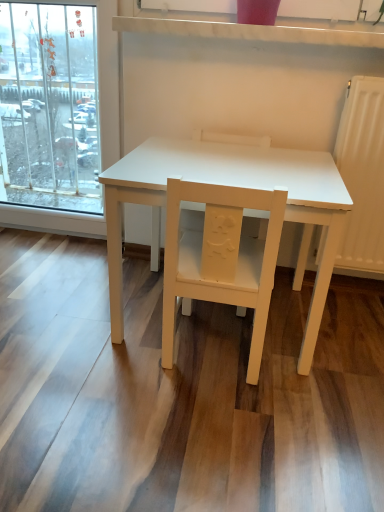
What do you see at coordinates (230, 138) in the screenshot? This screenshot has width=384, height=512. I see `white matte chair at center, the 1th chair viewed from the back` at bounding box center [230, 138].

Identify the location of white matte chair at center, the 1th chair viewed from the back. This screenshot has width=384, height=512. (230, 138).

Describe the element at coordinates (221, 258) in the screenshot. The image size is (384, 512). I see `matte yellow chair at center, arranged as the second chair when viewed from the back` at that location.

At what (x,y) coordinates should I click in order to perform the action: click on white matte table at center. Please return your answer as a coordinate pair (x, y). The width and height of the screenshot is (384, 512). Looking at the image, I should click on (232, 185).

From the image's perspective, is white matte table at center under matte yellow chair at center, arranged as the second chair when viewed from the back?

Incorrect, from the image's perspective, white matte table at center is higher than matte yellow chair at center, arranged as the second chair when viewed from the back.

Is point (336, 220) positioned after point (208, 259)?

No, it is not.

Where is `table above the matte yellow chair at center, the 1th chair positioned from the front (from the image's perspective)`? The width and height of the screenshot is (384, 512). table above the matte yellow chair at center, the 1th chair positioned from the front (from the image's perspective) is located at coordinates (232, 185).

Considering the sizes of objects white matte table at center and matte yellow chair at center, the 1th chair positioned from the front, in the image provided, who is thinner, white matte table at center or matte yellow chair at center, the 1th chair positioned from the front,?

matte yellow chair at center, the 1th chair positioned from the front, is thinner.

Which is behind, point (293, 170) or point (196, 131)?

Positioned behind is point (196, 131).

Who is taller, white matte table at center or white matte chair at center, which appears as the 2th chair when viewed from the front?

Standing taller between the two is white matte chair at center, which appears as the 2th chair when viewed from the front.

Is white matte chair at center, the 1th chair viewed from the back, a part of white matte table at center?

Yes, white matte chair at center, the 1th chair viewed from the back, is surrounded by white matte table at center.

Does point (254, 248) lie behind point (317, 166)?

Yes, it is.

Is matte yellow chair at center, arranged as the second chair when viewed from the back, at the right side of white matte table at center?

In fact, matte yellow chair at center, arranged as the second chair when viewed from the back, is to the left of white matte table at center.

Is white matte table at center at the back of matte yellow chair at center, the 1th chair positioned from the front?

That's right, matte yellow chair at center, the 1th chair positioned from the front, is facing away from white matte table at center.

Can you see matte yellow chair at center, the 1th chair positioned from the front, touching white matte chair at center, which appears as the 2th chair when viewed from the front?

No, matte yellow chair at center, the 1th chair positioned from the front, is not with white matte chair at center, which appears as the 2th chair when viewed from the front.

Based on the photo, is white matte chair at center, the 1th chair viewed from the back, located within matte yellow chair at center, arranged as the second chair when viewed from the back?

Actually, white matte chair at center, the 1th chair viewed from the back, is outside matte yellow chair at center, arranged as the second chair when viewed from the back.

Which is behind, matte yellow chair at center, arranged as the second chair when viewed from the back, or white matte chair at center, the 1th chair viewed from the back?

white matte chair at center, the 1th chair viewed from the back, is more distant.

Is matte yellow chair at center, arranged as the second chair when viewed from the back, bigger than white matte chair at center, the 1th chair viewed from the back?

Incorrect, matte yellow chair at center, arranged as the second chair when viewed from the back, is not larger than white matte chair at center, the 1th chair viewed from the back.

Based on the photo, does white matte chair at center, the 1th chair viewed from the back, have a lesser width compared to white matte table at center?

Correct, the width of white matte chair at center, the 1th chair viewed from the back, is less than that of white matte table at center.

From a real-world perspective, is white matte chair at center, the 1th chair viewed from the back, below white matte table at center?

No, from a real-world perspective, white matte chair at center, the 1th chair viewed from the back, is not beneath white matte table at center.

Which of these two, white matte chair at center, the 1th chair viewed from the back, or white matte table at center, is smaller?

white matte chair at center, the 1th chair viewed from the back.

From the picture: Is matte yellow chair at center, arranged as the second chair when viewed from the back, at the back of white matte chair at center, which appears as the 2th chair when viewed from the front?

white matte chair at center, which appears as the 2th chair when viewed from the front, is not turned away from matte yellow chair at center, arranged as the second chair when viewed from the back.

In the scene shown: Is white matte chair at center, which appears as the 2th chair when viewed from the front, at the right side of matte yellow chair at center, the 1th chair positioned from the front?

Correct, you'll find white matte chair at center, which appears as the 2th chair when viewed from the front, to the right of matte yellow chair at center, the 1th chair positioned from the front.

Looking at this image, from the image's perspective, between white matte chair at center, which appears as the 2th chair when viewed from the front, and matte yellow chair at center, arranged as the second chair when viewed from the back, which one is located above?

From the image's view, white matte chair at center, which appears as the 2th chair when viewed from the front, is above.

In order to click on the 2nd chair to the left of the white matte table at center, starting your count from the anchor in this screenshot , I will do `click(221, 258)`.

In the image, there is a white matte chair at center, the 1th chair viewed from the back. At what (x,y) coordinates should I click in order to perform the action: click on table below it (from the image's perspective). Please return your answer as a coordinate pair (x, y). This screenshot has width=384, height=512. Looking at the image, I should click on (232, 185).

Looking at the image, which one is located closer to white matte table at center, white matte chair at center, the 1th chair viewed from the back, or matte yellow chair at center, arranged as the second chair when viewed from the back?

matte yellow chair at center, arranged as the second chair when viewed from the back, is closer to white matte table at center.

Considering their positions, is white matte table at center positioned further to white matte chair at center, the 1th chair viewed from the back, than matte yellow chair at center, arranged as the second chair when viewed from the back?

The object further to white matte chair at center, the 1th chair viewed from the back, is matte yellow chair at center, arranged as the second chair when viewed from the back.

Which object lies nearer to the anchor point matte yellow chair at center, the 1th chair positioned from the front, white matte chair at center, which appears as the 2th chair when viewed from the front, or white matte table at center?

white matte table at center is closer to matte yellow chair at center, the 1th chair positioned from the front.

Estimate the real-world distances between objects in this image. Which object is closer to white matte table at center, matte yellow chair at center, arranged as the second chair when viewed from the back, or white matte chair at center, which appears as the 2th chair when viewed from the front?

matte yellow chair at center, arranged as the second chair when viewed from the back.

When comparing their distances from matte yellow chair at center, the 1th chair positioned from the front, does white matte table at center or white matte chair at center, the 1th chair viewed from the back, seem further?

Based on the image, white matte chair at center, the 1th chair viewed from the back, appears to be further to matte yellow chair at center, the 1th chair positioned from the front.

Which object lies nearer to the anchor point white matte chair at center, the 1th chair viewed from the back, matte yellow chair at center, the 1th chair positioned from the front, or white matte table at center?

Based on the image, white matte table at center appears to be nearer to white matte chair at center, the 1th chair viewed from the back.

Find the location of `table between matte yellow chair at center, arranged as the second chair when viewed from the back, and white matte chair at center, the 1th chair viewed from the back, from front to back`. table between matte yellow chair at center, arranged as the second chair when viewed from the back, and white matte chair at center, the 1th chair viewed from the back, from front to back is located at coordinates (232, 185).